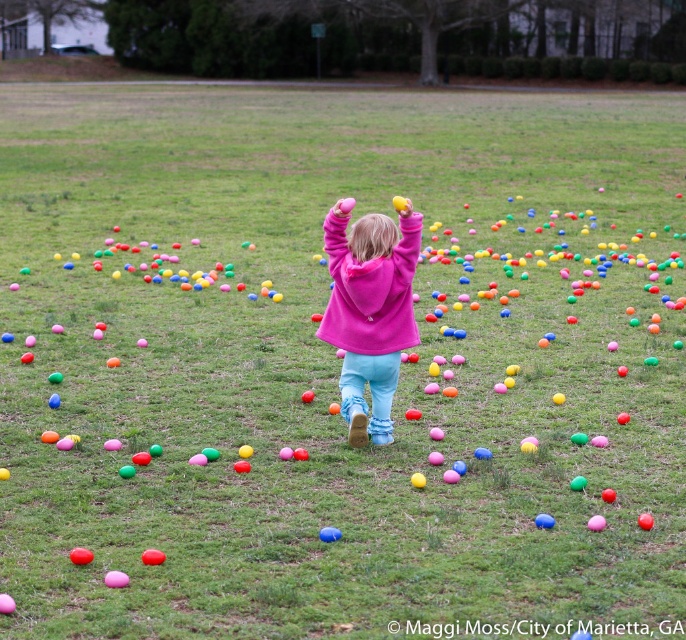
Question: Can you confirm if pink fleece jacket at center is wider than red rubber egg at center?

Choices:
 (A) no
 (B) yes

Answer: (B)

Question: Among these points, which one is nearest to the camera?

Choices:
 (A) (392, 227)
 (B) (84, 548)
 (C) (335, 528)

Answer: (B)

Question: Can you confirm if pink fleece jacket at center is thinner than smooth red ball at center?

Choices:
 (A) no
 (B) yes

Answer: (A)

Question: Estimate the real-world distances between objects in this image. Which object is farther from the blue rubber ball at center?

Choices:
 (A) red rubber egg at center
 (B) pink fleece jacket at center
 (C) smooth red ball at center

Answer: (B)

Question: Among these objects, which one is farthest from the camera?

Choices:
 (A) blue rubber ball at center
 (B) smooth red ball at center
 (C) red rubber egg at center

Answer: (A)

Question: Considering the relative positions of pink fleece jacket at center and blue rubber ball at center in the image provided, where is pink fleece jacket at center located with respect to blue rubber ball at center?

Choices:
 (A) above
 (B) below

Answer: (A)